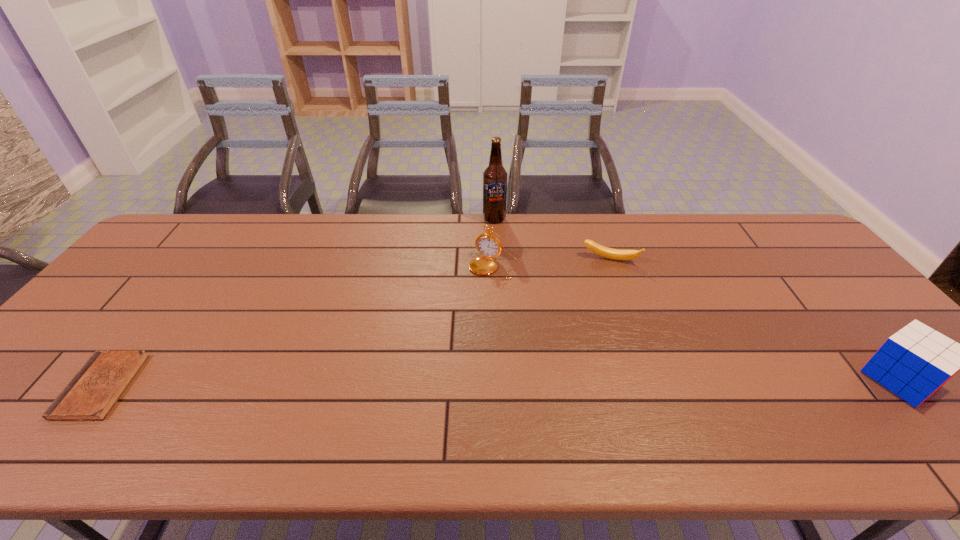
Identify the location of vacant point located between the diary and the second shortest object. Image resolution: width=960 pixels, height=540 pixels. (356, 323).

The height and width of the screenshot is (540, 960). I want to click on vacant space that is in between the leftmost object and the beer bottle, so click(x=298, y=302).

This screenshot has width=960, height=540. Find the location of `free space between the diary and the fourth object from left to right`. free space between the diary and the fourth object from left to right is located at coordinates (356, 323).

At what (x,y) coordinates should I click in order to perform the action: click on empty space that is in between the tallest object and the leftmost object. Please return your answer as a coordinate pair (x, y). Looking at the image, I should click on tap(298, 302).

The image size is (960, 540). I want to click on free space between the farthest object and the fourth tallest object, so click(x=552, y=239).

The height and width of the screenshot is (540, 960). I want to click on unoccupied position between the shortest object and the banana, so click(356, 323).

Locate which object is the fourth closest to the beer bottle. Please provide its 2D coordinates. Your answer should be formatted as a tuple, i.e. [(x, y)], where the tuple contains the x and y coordinates of a point satisfying the conditions above.

[(91, 394)]

Find the location of `object that is the closest to the cube`. object that is the closest to the cube is located at coordinates (615, 254).